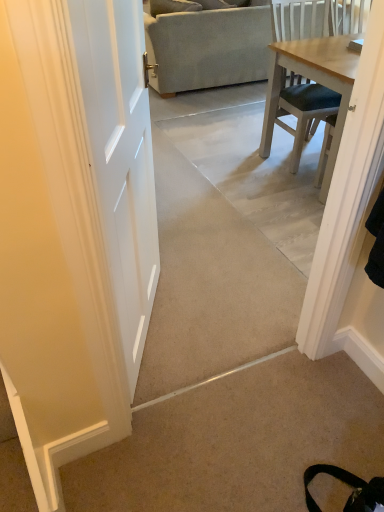
Question: Should I look upward or downward to see light gray fabric couch at upper center?

Choices:
 (A) up
 (B) down

Answer: (A)

Question: Is light gray fabric couch at upper center next to beige carpet at lower right and touching it?

Choices:
 (A) no
 (B) yes

Answer: (A)

Question: From the image's perspective, does light gray fabric couch at upper center appear higher than beige carpet at lower right?

Choices:
 (A) no
 (B) yes

Answer: (B)

Question: Does light gray fabric couch at upper center lie in front of beige carpet at lower right?

Choices:
 (A) yes
 (B) no

Answer: (B)

Question: Does light gray fabric couch at upper center have a lesser height compared to beige carpet at lower right?

Choices:
 (A) yes
 (B) no

Answer: (B)

Question: Does light gray fabric couch at upper center have a lesser width compared to beige carpet at lower right?

Choices:
 (A) yes
 (B) no

Answer: (B)

Question: Is light gray fabric couch at upper center taller than beige carpet at lower right?

Choices:
 (A) yes
 (B) no

Answer: (A)

Question: Is beige carpet at lower right outside of light gray fabric couch at upper center?

Choices:
 (A) no
 (B) yes

Answer: (B)

Question: Can you confirm if beige carpet at lower right is bigger than light gray fabric couch at upper center?

Choices:
 (A) no
 (B) yes

Answer: (A)

Question: From a real-world perspective, is beige carpet at lower right positioned over light gray fabric couch at upper center based on gravity?

Choices:
 (A) yes
 (B) no

Answer: (B)

Question: From the image's perspective, is beige carpet at lower right under light gray fabric couch at upper center?

Choices:
 (A) no
 (B) yes

Answer: (B)

Question: Is beige carpet at lower right at the left side of light gray fabric couch at upper center?

Choices:
 (A) no
 (B) yes

Answer: (B)

Question: Does beige carpet at lower right lie in front of light gray fabric couch at upper center?

Choices:
 (A) yes
 (B) no

Answer: (A)

Question: Is point (190, 12) closer or farther from the camera than point (163, 464)?

Choices:
 (A) closer
 (B) farther

Answer: (B)